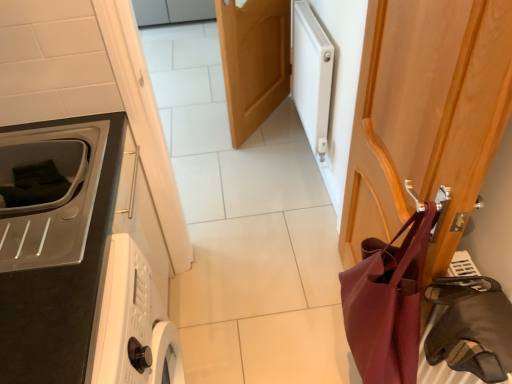
Describe the element at coordinates (312, 76) in the screenshot. I see `white matte radiator at upper right` at that location.

This screenshot has height=384, width=512. What do you see at coordinates (64, 194) in the screenshot?
I see `matte black microwave at left` at bounding box center [64, 194].

At what (x,y) coordinates should I click in order to perform the action: click on wooden coat hanger at right, which is the 2th door in left-to-right order. Please return your answer as a coordinate pair (x, y). The width and height of the screenshot is (512, 384). Looking at the image, I should click on (426, 116).

What do you see at coordinates (426, 116) in the screenshot? This screenshot has height=384, width=512. I see `wooden coat hanger at right, positioned as the second door in back-to-front order` at bounding box center [426, 116].

Where is `white matte radiator at upper right`? Image resolution: width=512 pixels, height=384 pixels. white matte radiator at upper right is located at coordinates (312, 76).

Is point (458, 66) farther from viewer compared to point (486, 372)?

No, it is not.

Is wooden coat hanger at right, positioned as the second door in back-to-front order, beside leather-like brown bag at right?

No, wooden coat hanger at right, positioned as the second door in back-to-front order, is not next to leather-like brown bag at right.

From the image's perspective, which is below, wooden coat hanger at right, the first door viewed from the right, or leather-like brown bag at right?

leather-like brown bag at right, from the image's perspective.

Who is smaller, wooden coat hanger at right, positioned as the second door in back-to-front order, or leather-like brown bag at right?

leather-like brown bag at right.

Considering the relative sizes of wooden coat hanger at right, positioned as the second door in back-to-front order, and wooden door at center, which appears as the 1th door when viewed from the left, in the image provided, is wooden coat hanger at right, positioned as the second door in back-to-front order, wider than wooden door at center, which appears as the 1th door when viewed from the left,?

A: Yes.

From the image's perspective, is wooden coat hanger at right, positioned as the second door in back-to-front order, positioned above or below wooden door at center, which appears as the 1th door when viewed from the left?

wooden coat hanger at right, positioned as the second door in back-to-front order, is below wooden door at center, which appears as the 1th door when viewed from the left.

Is the position of wooden coat hanger at right, placed as the 1th door when sorted from front to back, less distant than that of wooden door at center, the 2th door positioned from the front?

Yes, the depth of wooden coat hanger at right, placed as the 1th door when sorted from front to back, is less than that of wooden door at center, the 2th door positioned from the front.

Which of these two, wooden coat hanger at right, which is the 2th door in left-to-right order, or wooden door at center, marked as the second door in a right-to-left arrangement, stands taller?

With more height is wooden coat hanger at right, which is the 2th door in left-to-right order.

Does point (329, 82) come in front of point (508, 311)?

No, (329, 82) is further to viewer.

Between white matte radiator at upper right and leather-like brown bag at right, which one appears on the left side from the viewer's perspective?

Positioned to the left is white matte radiator at upper right.

Is white matte radiator at upper right aimed at leather-like brown bag at right?

No.

Is leather-like brown bag at right inside white matte radiator at upper right?

That's incorrect, leather-like brown bag at right is not inside white matte radiator at upper right.

Could you tell me if matte black microwave at left is turned towards leather-like brown bag at right?

No.

Considering the sizes of objects matte black microwave at left and leather-like brown bag at right in the image provided, who is wider, matte black microwave at left or leather-like brown bag at right?

With larger width is matte black microwave at left.

Consider the image. Between matte black microwave at left and leather-like brown bag at right, which one appears on the right side from the viewer's perspective?

Positioned to the right is leather-like brown bag at right.

How different are the orientations of matte black microwave at left and leather-like brown bag at right in degrees?

The facing directions of matte black microwave at left and leather-like brown bag at right are 178 degrees apart.

Is point (433, 221) positioned before point (460, 52)?

No, (433, 221) is behind (460, 52).

Considering the positions of objects matte burgundy leather shoulder bag at right and wooden coat hanger at right, positioned as the second door in back-to-front order, in the image provided, who is behind, matte burgundy leather shoulder bag at right or wooden coat hanger at right, positioned as the second door in back-to-front order,?

matte burgundy leather shoulder bag at right is further from the camera.

Is matte burgundy leather shoulder bag at right looking in the opposite direction of wooden coat hanger at right, placed as the 1th door when sorted from front to back?

Yes.

Can wooden coat hanger at right, which is the 2th door in left-to-right order, be found inside matte burgundy leather shoulder bag at right?

No, wooden coat hanger at right, which is the 2th door in left-to-right order, is not inside matte burgundy leather shoulder bag at right.

Does point (47, 135) come closer to viewer compared to point (241, 90)?

Yes, point (47, 135) is in front of point (241, 90).

From the image's perspective, which is above, matte black microwave at left or wooden door at center, which is counted as the 1th door, starting from the back?

wooden door at center, which is counted as the 1th door, starting from the back, appears higher in the image.

Is the position of matte black microwave at left less distant than that of wooden door at center, which is counted as the 1th door, starting from the back?

Yes, matte black microwave at left is in front of wooden door at center, which is counted as the 1th door, starting from the back.

Between matte black microwave at left and wooden door at center, which is counted as the 1th door, starting from the back, which one has more height?

wooden door at center, which is counted as the 1th door, starting from the back.

Is wooden coat hanger at right, the first door viewed from the right, positioned beyond the bounds of matte black microwave at left?

Yes, wooden coat hanger at right, the first door viewed from the right, is located beyond the bounds of matte black microwave at left.

From a real-world perspective, is wooden coat hanger at right, which is the 2th door in left-to-right order, over matte black microwave at left?

No, from a real-world perspective, wooden coat hanger at right, which is the 2th door in left-to-right order, is not over matte black microwave at left

At what (x,y) coordinates should I click in order to perform the action: click on door in front of the matte black microwave at left. Please return your answer as a coordinate pair (x, y). The image size is (512, 384). Looking at the image, I should click on (426, 116).

From the picture: Measure the distance between wooden coat hanger at right, positioned as the second door in back-to-front order, and matte black microwave at left.

wooden coat hanger at right, positioned as the second door in back-to-front order, is 33.61 inches away from matte black microwave at left.

From the image's perspective, count 1st doors upward from the leather-like brown bag at right and point to it. Please provide its 2D coordinates.

[(426, 116)]

Find the location of `door located on the right of wooden door at center, which appears as the 1th door when viewed from the left`. door located on the right of wooden door at center, which appears as the 1th door when viewed from the left is located at coordinates (426, 116).

Based on the photo, looking at the image, which one is located further to wooden coat hanger at right, the first door viewed from the right, leather-like brown bag at right or white matte radiator at upper right?

Based on the image, white matte radiator at upper right appears to be further to wooden coat hanger at right, the first door viewed from the right.

Looking at the image, which one is located further to wooden door at center, which is counted as the 1th door, starting from the back, wooden coat hanger at right, positioned as the second door in back-to-front order, or matte burgundy leather shoulder bag at right?

The object further to wooden door at center, which is counted as the 1th door, starting from the back, is matte burgundy leather shoulder bag at right.

Based on their spatial positions, is matte burgundy leather shoulder bag at right or wooden door at center, which appears as the 1th door when viewed from the left, further from white matte radiator at upper right?

The object further to white matte radiator at upper right is matte burgundy leather shoulder bag at right.

Considering their positions, is wooden door at center, which is counted as the 1th door, starting from the back, positioned closer to matte burgundy leather shoulder bag at right than white matte radiator at upper right?

The object closer to matte burgundy leather shoulder bag at right is white matte radiator at upper right.

Considering their positions, is wooden door at center, which appears as the 1th door when viewed from the left, positioned further to wooden coat hanger at right, the first door viewed from the right, than matte black microwave at left?

wooden door at center, which appears as the 1th door when viewed from the left, is positioned further to the anchor wooden coat hanger at right, the first door viewed from the right.

From the image, which object appears to be farther from wooden door at center, which appears as the 1th door when viewed from the left, matte burgundy leather shoulder bag at right or leather-like brown bag at right?

leather-like brown bag at right is further to wooden door at center, which appears as the 1th door when viewed from the left.

From the image, which object appears to be farther from white matte radiator at upper right, wooden door at center, marked as the second door in a right-to-left arrangement, or matte black microwave at left?

matte black microwave at left.

Which object lies further to the anchor point white matte radiator at upper right, wooden coat hanger at right, positioned as the second door in back-to-front order, or matte burgundy leather shoulder bag at right?

matte burgundy leather shoulder bag at right.

The width and height of the screenshot is (512, 384). What are the coordinates of `shoulder bag between wooden coat hanger at right, placed as the 1th door when sorted from front to back, and leather-like brown bag at right, in the vertical direction` in the screenshot? It's located at (388, 304).

Find the location of a particular element. The height and width of the screenshot is (384, 512). appliance between matte burgundy leather shoulder bag at right and wooden door at center, marked as the second door in a right-to-left arrangement, from front to back is located at coordinates (312, 76).

Find the location of a particular element. shoulder bag between wooden coat hanger at right, which is the 2th door in left-to-right order, and wooden door at center, which is counted as the 1th door, starting from the back, along the z-axis is located at coordinates (388, 304).

The image size is (512, 384). I want to click on home appliance located between matte burgundy leather shoulder bag at right and white matte radiator at upper right in the depth direction, so coord(64,194).